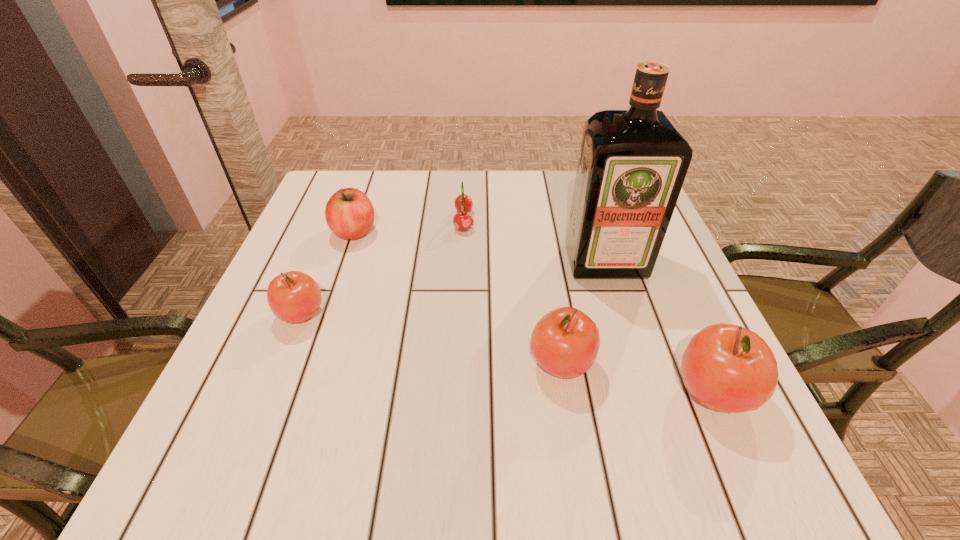
The image size is (960, 540). What are the coordinates of `vacant point that satisfies the following two spatial constraints: 1. on the front side of the second tallest apple; 2. on the left side of the rightmost apple` in the screenshot? It's located at click(x=565, y=393).

I want to click on free spot that satisfies the following two spatial constraints: 1. with stems pointing upwards on the third object from left to right; 2. on the front side of the third nearest apple, so click(x=460, y=314).

Find the location of a particular element. This screenshot has height=540, width=960. vacant position in the image that satisfies the following two spatial constraints: 1. on the front label of the liquor; 2. on the right side of the rightmost apple is located at coordinates (647, 393).

Locate an element on the screen. This screenshot has width=960, height=540. vacant space that satisfies the following two spatial constraints: 1. with stems pointing upwards on the third object from left to right; 2. on the back side of the third apple from left to right is located at coordinates (458, 363).